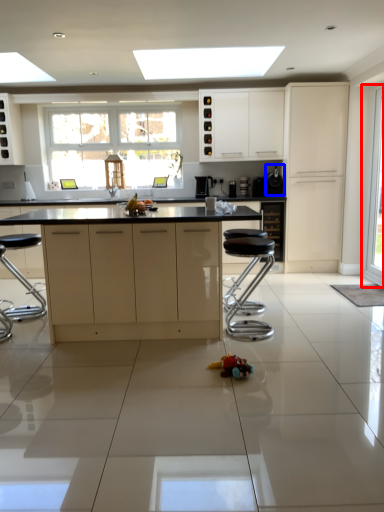
Question: Among these objects, which one is farthest to the camera, glass door (highlighted by a red box) or appliance (highlighted by a blue box)?

Choices:
 (A) glass door
 (B) appliance

Answer: (B)